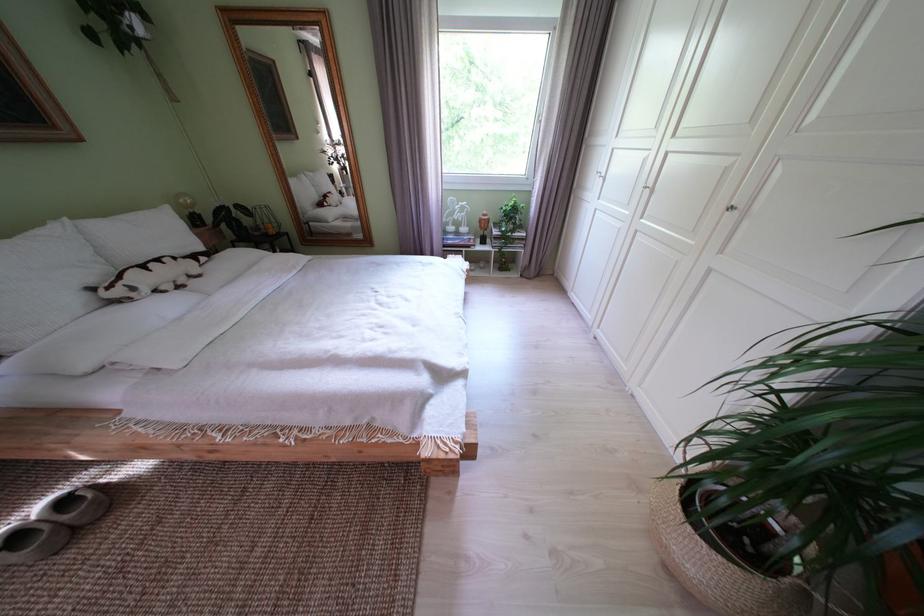
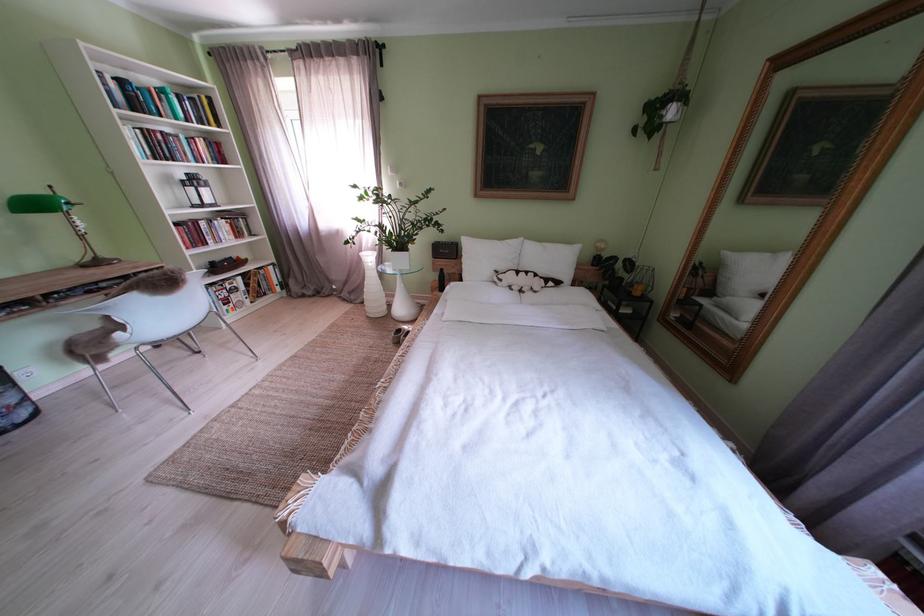
The point at (284,237) is marked in the first image. Where is the corresponding point in the second image?

(648, 299)